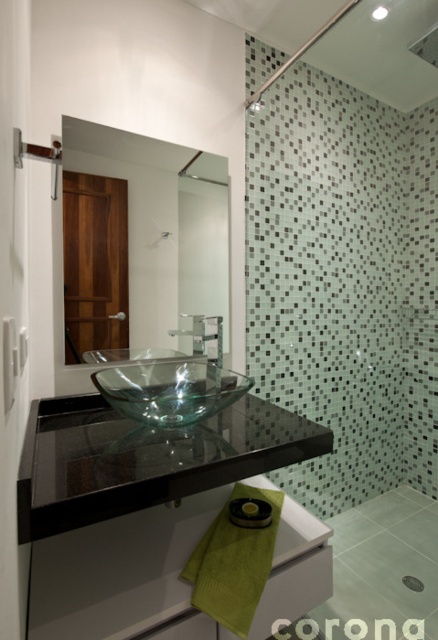
Can you confirm if black glass counter top at center is taller than transparent glass bowl at center?

Correct, black glass counter top at center is much taller as transparent glass bowl at center.

Does black glass counter top at center have a greater width compared to transparent glass bowl at center?

Yes.

Find the location of a particular element. black glass counter top at center is located at coordinates (144, 460).

Which is more to the right, satin nickel faucet at upper center or black rubber towel bar at lower center?

Positioned to the right is black rubber towel bar at lower center.

Who is more forward, (197,337) or (264,506)?

Point (264,506) is in front.

At what (x,y) coordinates should I click in order to perform the action: click on satin nickel faucet at upper center. Please return your answer as a coordinate pair (x, y). The image size is (438, 640). Looking at the image, I should click on [204, 336].

From the picture: Is black glass counter top at center further to camera compared to clear glass mirror at upper center?

No, black glass counter top at center is in front of clear glass mirror at upper center.

Looking at this image, can you confirm if black glass counter top at center is wider than clear glass mirror at upper center?

Indeed, black glass counter top at center has a greater width compared to clear glass mirror at upper center.

What do you see at coordinates (144, 460) in the screenshot? This screenshot has width=438, height=640. I see `black glass counter top at center` at bounding box center [144, 460].

Find the location of a particular element. This screenshot has width=438, height=640. black glass counter top at center is located at coordinates (144, 460).